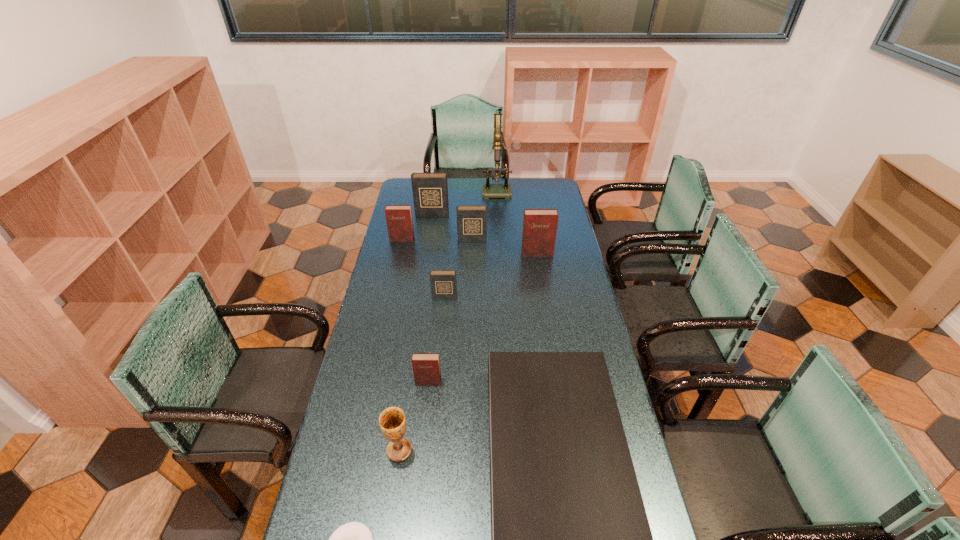
You are a GUI agent. You are given a task and a screenshot of the screen. Output one action in this format:
    pyautogui.click(x=<x>, y=<y>)
    Task: Click on the second nearest diary
    
    Given the screenshot: What is the action you would take?
    pyautogui.click(x=443, y=283)

Locate an element on the screen. the sixth farthest object is located at coordinates (443, 283).

This screenshot has height=540, width=960. I want to click on the second reddish-brown diary from left to right, so click(426, 366).

At what (x,y) coordinates should I click in order to perform the action: click on the smallest reddish-brown diary. Please return your answer as a coordinate pair (x, y). The height and width of the screenshot is (540, 960). Looking at the image, I should click on (426, 366).

At what (x,y) coordinates should I click in order to perform the action: click on blank area located at the eyepiece of the tallest object. Please return your answer as a coordinate pair (x, y). The image size is (960, 540). Looking at the image, I should click on (502, 224).

Locate an element on the screen. This screenshot has height=540, width=960. vacant space positioned 0.270m on the front cover of the farthest diary is located at coordinates (426, 249).

Image resolution: width=960 pixels, height=540 pixels. In order to click on free space located on the front cover of the third nearest diary in this screenshot , I will do `click(545, 305)`.

Where is `free location located 0.340m on the front cover of the second biggest reddish-brown diary`? free location located 0.340m on the front cover of the second biggest reddish-brown diary is located at coordinates (391, 291).

You are a GUI agent. You are given a task and a screenshot of the screen. Output one action in this format:
    pyautogui.click(x=<x>, y=<y>)
    Task: Click on the vacant space situated 0.220m on the front cover of the second farthest dark diary
    The width and height of the screenshot is (960, 540).
    Given the screenshot: What is the action you would take?
    pyautogui.click(x=471, y=272)

The height and width of the screenshot is (540, 960). Identify the location of vacant region located 0.290m on the right of the chalice. (510, 450).